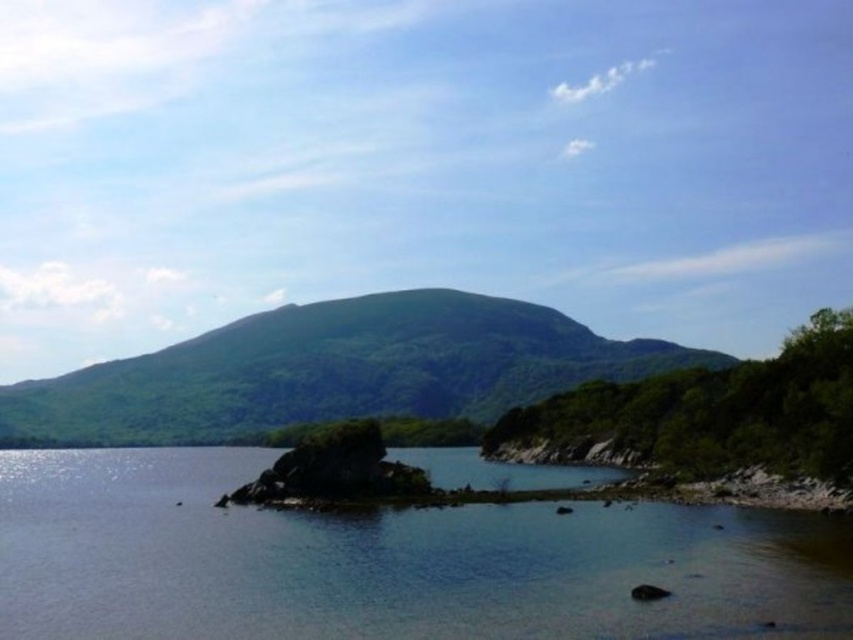
You are standing at the edge of the water in the serene natural landscape. There is a point marked at coordinates (387, 561) which indicates clear water at center. If you want to find the clearest part of the water to take a photo, where should you walk towards?

You should walk towards the point marked at coordinates (387, 561), as it indicates the clearest water at the center of the scene.

You are standing on the shore of the serene natural landscape shown. You see the clear water at center and the green leafy mountain at center. Which one is higher from your viewpoint?

The clear water at center is above the green leafy mountain at center, so the clear water at center is higher from your viewpoint.

You are standing at the edge of the water in the serene landscape scene. There are two points marked in the image. Which point, point (3, 598) or point (502, 339), is closer to you?

Point (3, 598) is closer to the viewer than point (502, 339).